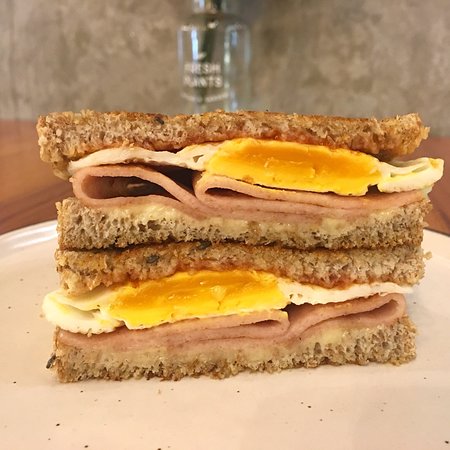
This screenshot has height=450, width=450. Identify the location of grey faux marble wall. (388, 43).